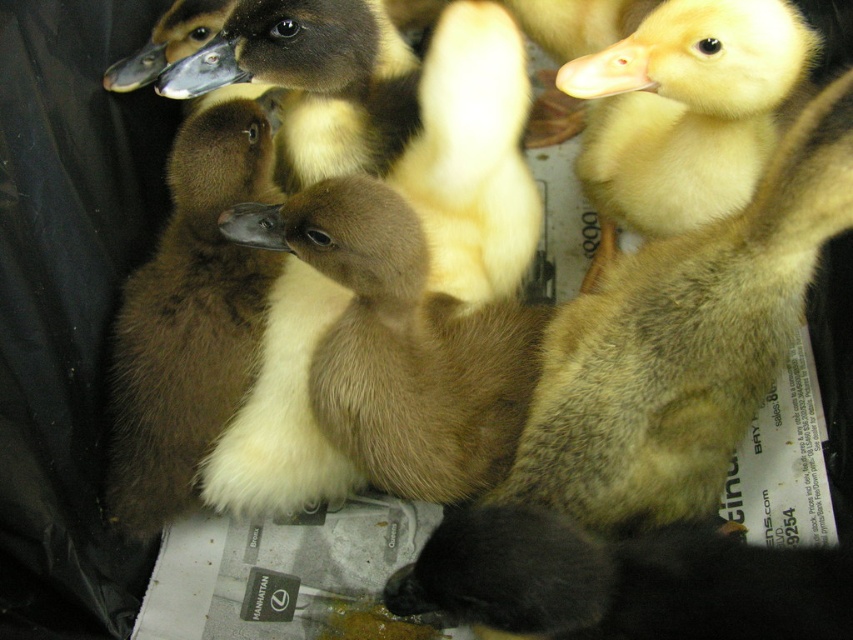
Question: Which point appears closest to the camera in this image?

Choices:
 (A) (187, 496)
 (B) (317, 192)

Answer: (B)

Question: Does brown fluffy duckling at center have a greater width compared to brown fuzzy duckling at center?

Choices:
 (A) yes
 (B) no

Answer: (A)

Question: Which of the following is the closest to the observer?

Choices:
 (A) (224, 264)
 (B) (422, 244)

Answer: (B)

Question: Considering the relative positions of brown fluffy duckling at center and brown fuzzy duckling at center in the image provided, where is brown fluffy duckling at center located with respect to brown fuzzy duckling at center?

Choices:
 (A) above
 (B) below

Answer: (B)

Question: Is brown fluffy duckling at center above brown fuzzy duckling at center?

Choices:
 (A) yes
 (B) no

Answer: (B)